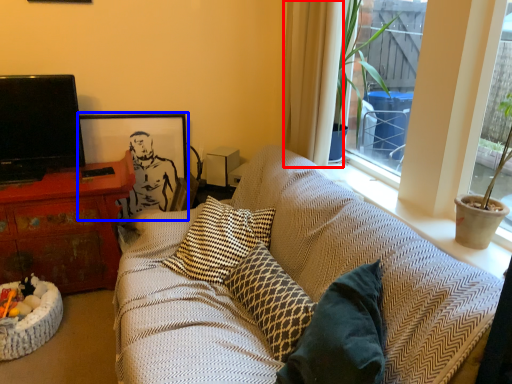
Question: Which point is further to the camera, curtain (highlighted by a red box) or picture frame (highlighted by a blue box)?

Choices:
 (A) curtain
 (B) picture frame

Answer: (B)